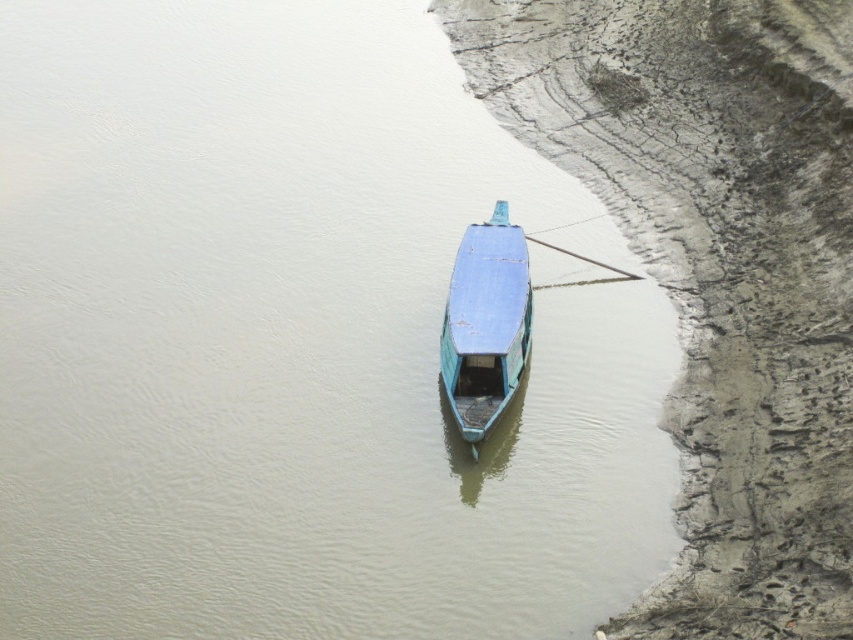
Question: Is muddy dirt river bank at lower right positioned behind blue matte boat at center?

Choices:
 (A) yes
 (B) no

Answer: (B)

Question: Is muddy dirt river bank at lower right above blue matte boat at center?

Choices:
 (A) yes
 (B) no

Answer: (A)

Question: Observing the image, what is the correct spatial positioning of muddy dirt river bank at lower right in reference to blue matte boat at center?

Choices:
 (A) left
 (B) right

Answer: (B)

Question: Which object appears farthest from the camera in this image?

Choices:
 (A) blue matte boat at center
 (B) muddy dirt river bank at lower right

Answer: (A)